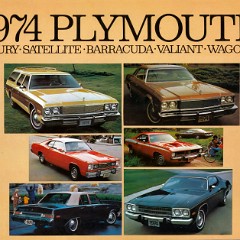
The height and width of the screenshot is (240, 240). I want to click on hoods, so click(x=61, y=98), click(x=175, y=91), click(x=98, y=160), click(x=183, y=144), click(x=169, y=201).